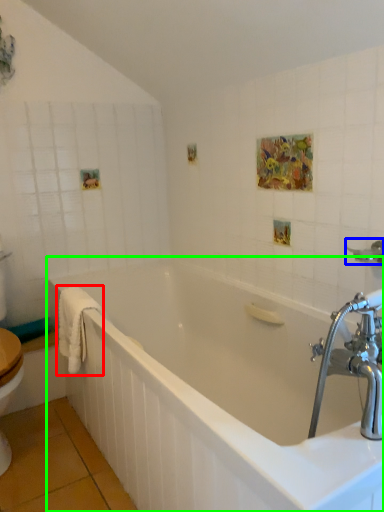
Question: Which is nearer to the bath towel (highlighted by a red box)? shower (highlighted by a blue box) or bathtub (highlighted by a green box).

Choices:
 (A) shower
 (B) bathtub

Answer: (B)